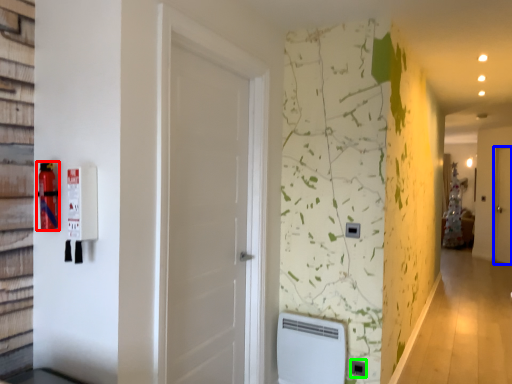
Question: Based on their relative distances, which object is nearer to extinguisher (highlighted by a red box)? Choose from door (highlighted by a blue box) and electric outlet (highlighted by a green box).

Choices:
 (A) door
 (B) electric outlet

Answer: (B)